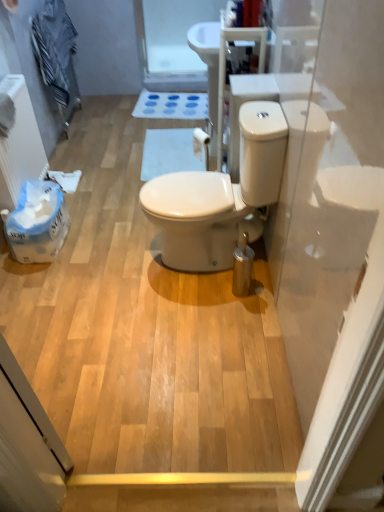
Question: Is white matte toilet paper at center spatially inside white matte bath mat at center, or outside of it?

Choices:
 (A) outside
 (B) inside

Answer: (A)

Question: From a real-world perspective, is white matte toilet paper at center physically located above or below white matte bath mat at center?

Choices:
 (A) below
 (B) above

Answer: (B)

Question: Estimate the real-world distances between objects in this image. Which object is closer to the white glossy toilet at center?

Choices:
 (A) transparent plastic screen door at upper center
 (B) white plastic radiator at left
 (C) white matte toilet paper at center
 (D) striped cotton towel at upper left
 (E) white matte bath mat at center

Answer: (C)

Question: Considering the real-world distances, which object is closest to the striped cotton towel at upper left?

Choices:
 (A) white plastic radiator at left
 (B) transparent plastic screen door at upper center
 (C) white glossy toilet at center
 (D) white matte bath mat at center
 (E) white matte toilet paper at center

Answer: (B)